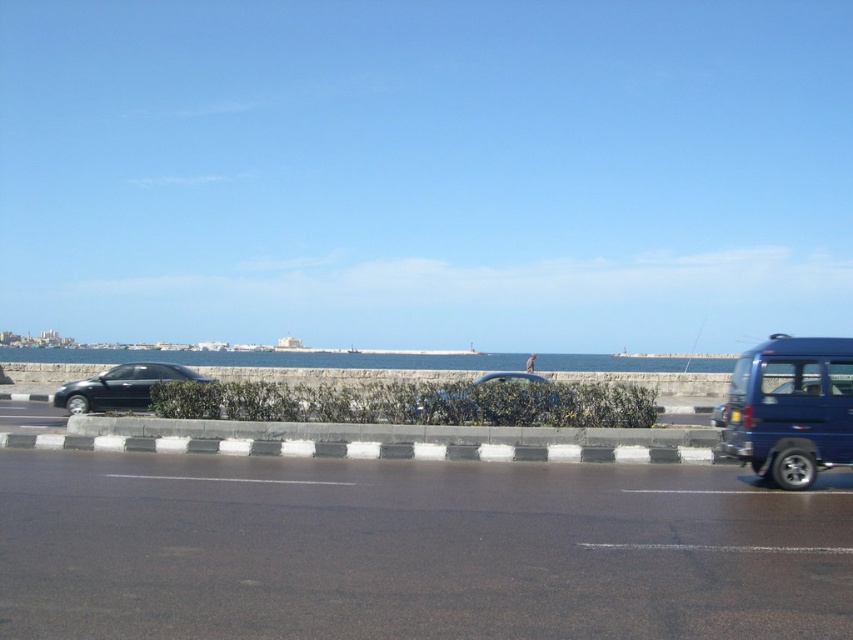
Based on the photo, you are driving a car that is 5 meters long. You want to park your car between the black asphalt highway at center and the shiny black sedan at left. Is there enough space between them to park your car?

The distance between the black asphalt highway at center and the shiny black sedan at left is 10.18 meters. Since your car is only 5 meters long, there is sufficient space to park between them.

Looking at this image, you are a delivery driver who needs to park your truck between the metallic blue van at right and the blue water at center. Is there enough space for your truck, which is 6 meters long, between them?

The metallic blue van at right is positioned on the right side of blue water at center, but the distance between them isn not specified in the objects description. Therefore, it is unclear if there is enough space for the truck.